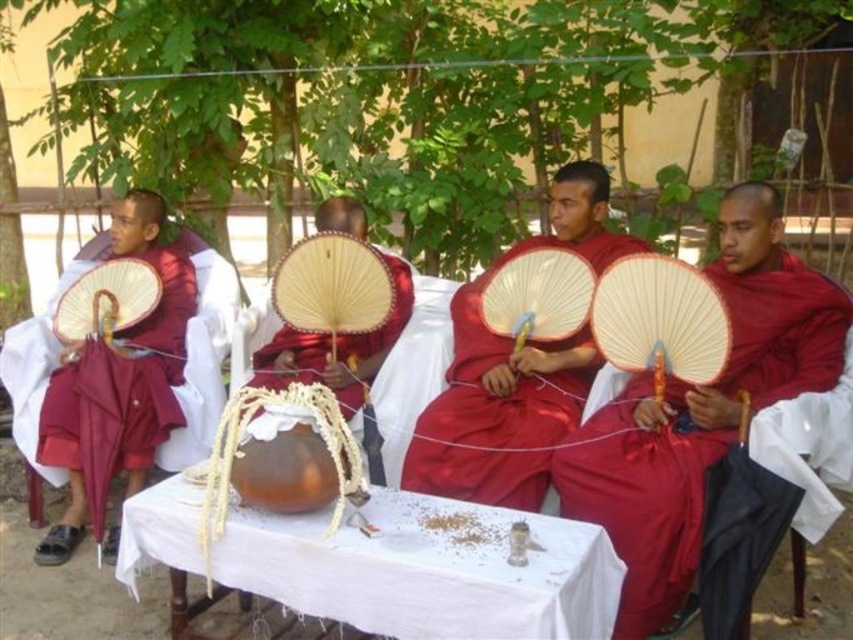
Question: Does white cloth table at center come in front of matte red umbrella at left?

Choices:
 (A) no
 (B) yes

Answer: (B)

Question: Which object is the farthest from the matte red robe at right?

Choices:
 (A) matte red fan at center
 (B) matte bamboo fan at center
 (C) matte red umbrella at left
 (D) white cloth table at center

Answer: (C)

Question: Is matte red robe at right wider than matte red umbrella at left?

Choices:
 (A) no
 (B) yes

Answer: (B)

Question: Is white cloth table at center closer to camera compared to matte red umbrella at left?

Choices:
 (A) no
 (B) yes

Answer: (B)

Question: Which object appears closest to the camera in this image?

Choices:
 (A) matte red umbrella at left
 (B) matte red robe at right
 (C) white cloth table at center
 (D) matte bamboo fan at center

Answer: (C)

Question: Which of the following is the closest to the observer?

Choices:
 (A) matte red fan at center
 (B) matte red robe at right
 (C) white cloth table at center
 (D) matte red umbrella at left

Answer: (C)